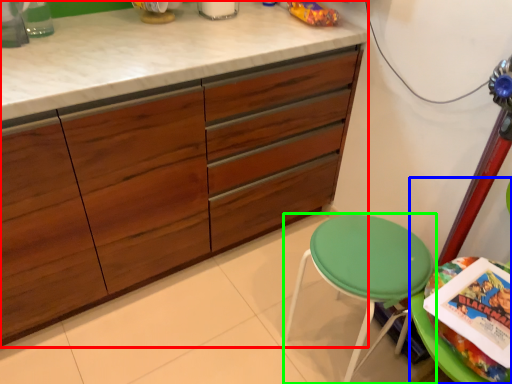
Question: Which object is positioned closest to cabinetry (highlighted by a red box)? Select from swivel chair (highlighted by a blue box) and stool (highlighted by a green box).

Choices:
 (A) swivel chair
 (B) stool

Answer: (B)